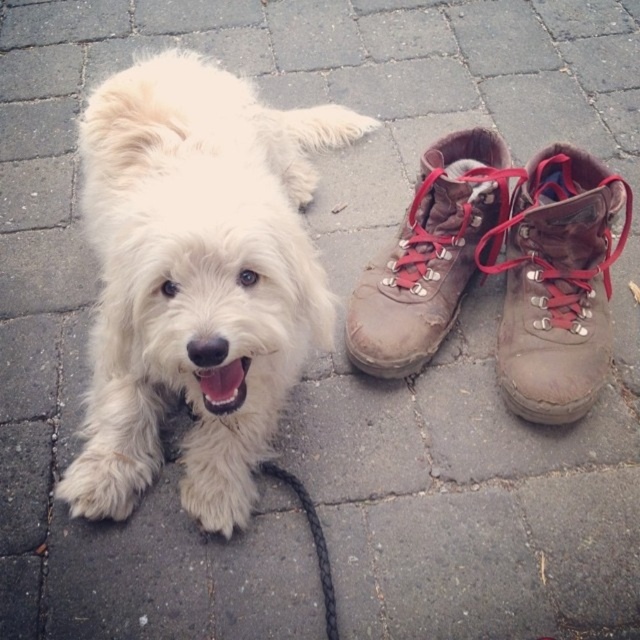
Is white fluffy dog at upper left taller than brown leather boot at right?

Indeed, white fluffy dog at upper left has a greater height compared to brown leather boot at right.

Who is taller, white fluffy dog at upper left or brown leather boot at right?

Standing taller between the two is white fluffy dog at upper left.

At what (x,y) coordinates should I click in order to perform the action: click on white fluffy dog at upper left. Please return your answer as a coordinate pair (x, y). The height and width of the screenshot is (640, 640). Looking at the image, I should click on (195, 280).

Is brown leather boot at right shorter than black braided leash at lower center?

No.

I want to click on brown leather boot at right, so click(x=557, y=284).

Can you confirm if brown leather boot at center is bigger than black braided leash at lower center?

Correct, brown leather boot at center is larger in size than black braided leash at lower center.

Can you confirm if brown leather boot at center is taller than black braided leash at lower center?

Yes.

Is point (420, 289) closer to viewer compared to point (282, 474)?

No, (420, 289) is behind (282, 474).

This screenshot has width=640, height=640. Find the location of `brown leather boot at center`. brown leather boot at center is located at coordinates (428, 257).